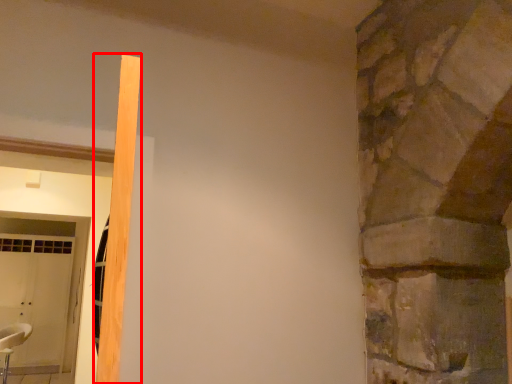
Question: From the image's perspective, what is the correct spatial positioning of beam (annotated by the red box) in reference to chair?

Choices:
 (A) below
 (B) above

Answer: (B)